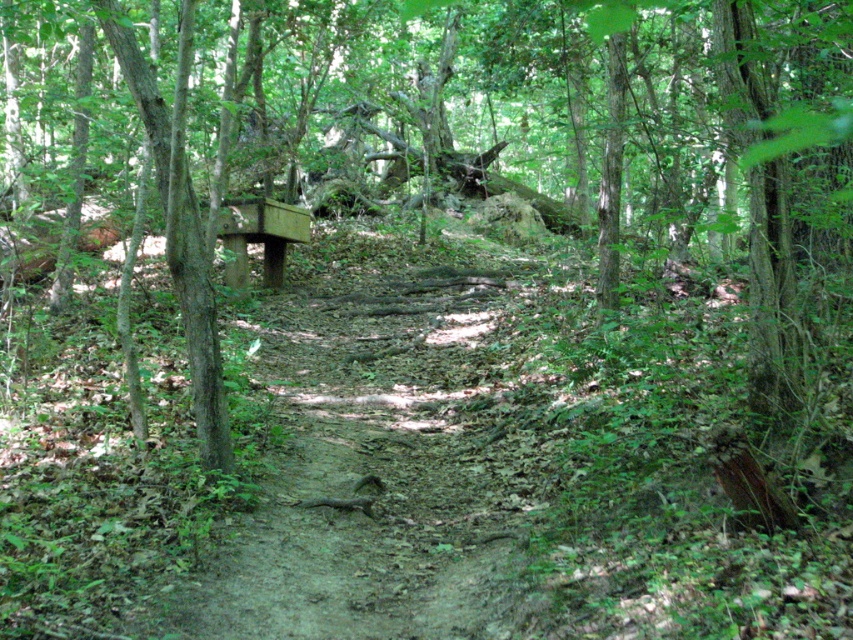
Question: Does smooth brown tree trunk at left appear under wooden bench at center?

Choices:
 (A) yes
 (B) no

Answer: (A)

Question: Which of the following is the closest to the observer?

Choices:
 (A) (199, 228)
 (B) (265, 234)

Answer: (A)

Question: Does smooth brown tree trunk at left appear on the left side of wooden bench at center?

Choices:
 (A) no
 (B) yes

Answer: (A)

Question: Does smooth brown tree trunk at left have a lesser width compared to wooden bench at center?

Choices:
 (A) no
 (B) yes

Answer: (B)

Question: Among these points, which one is farthest from the camera?

Choices:
 (A) (152, 97)
 (B) (236, 275)

Answer: (B)

Question: Which object appears closest to the camera in this image?

Choices:
 (A) wooden bench at center
 (B) smooth brown tree trunk at left

Answer: (B)